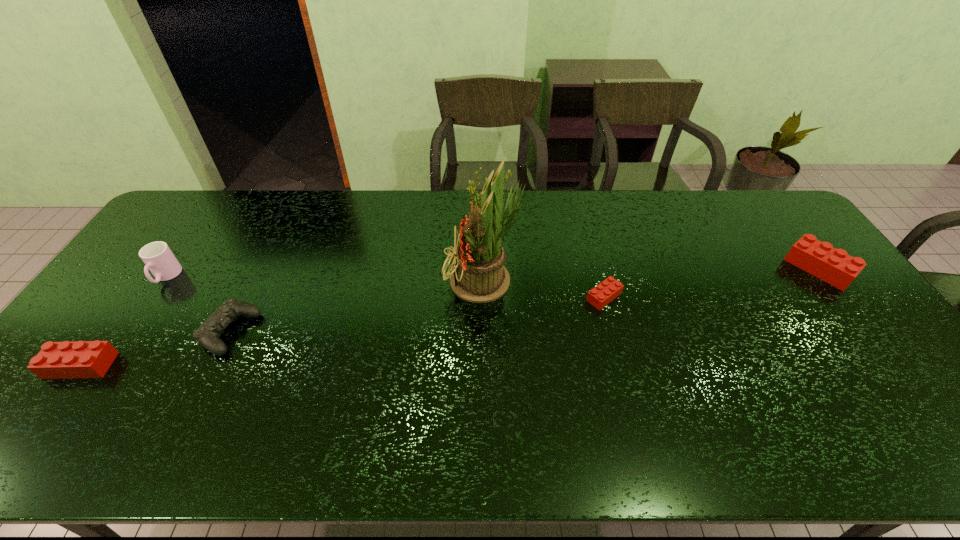
The image size is (960, 540). I want to click on free spot between the fourth object from right to left and the tallest object, so click(x=358, y=307).

This screenshot has width=960, height=540. What are the coordinates of `free area in between the cup and the tallest object` in the screenshot? It's located at (326, 279).

Identify the location of blank region between the control and the rightmost Lego. (524, 300).

Image resolution: width=960 pixels, height=540 pixels. What are the coordinates of `free area in between the rightmost object and the fourth object from right to left` in the screenshot? It's located at (524, 300).

This screenshot has height=540, width=960. I want to click on free spot between the flower arrangement and the fifth object from left to right, so click(545, 289).

Identify which object is the fourth closest to the rightmost Lego. Please provide its 2D coordinates. Your answer should be formatted as a tuple, i.e. [(x, y)], where the tuple contains the x and y coordinates of a point satisfying the conditions above.

[(157, 256)]

Where is `object that stands as the closest to the control`? object that stands as the closest to the control is located at coordinates click(x=157, y=256).

What are the coordinates of `Lego that stands as the second closest to the leftmost Lego` in the screenshot? It's located at (834, 266).

This screenshot has height=540, width=960. What are the coordinates of `Lego identified as the closest to the second tallest object` in the screenshot? It's located at (83, 359).

Locate an element on the screen. This screenshot has height=540, width=960. vacant position in the image that satisfies the following two spatial constraints: 1. on the front side of the rightmost object; 2. in front of the flower arrangement with the fan visible is located at coordinates (828, 281).